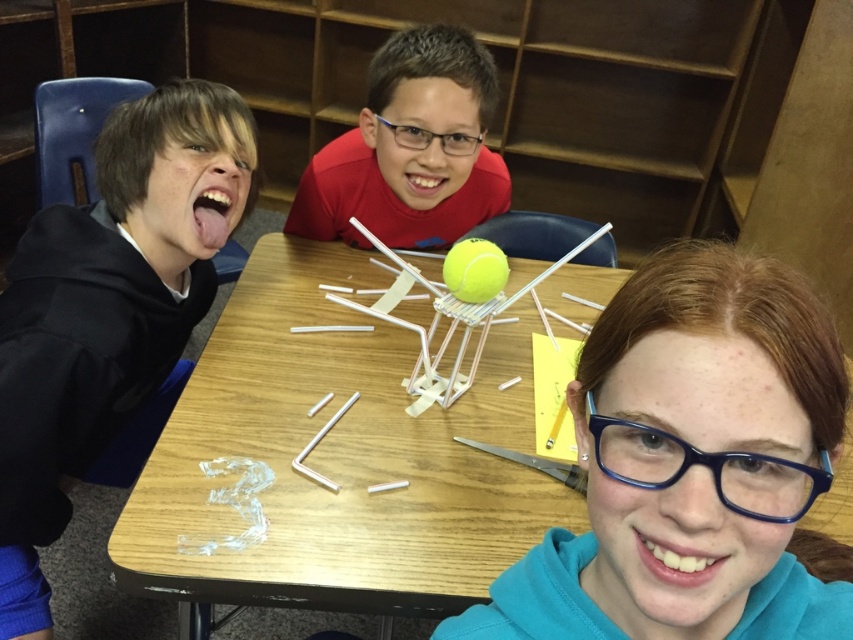
Question: Estimate the real-world distances between objects in this image. Which object is closer to the black hoodie at left?

Choices:
 (A) matte red shirt at center
 (B) wooden table at center
 (C) blue plastic hair at center

Answer: (B)

Question: Is wooden table at center further to the viewer compared to blue plastic hair at center?

Choices:
 (A) yes
 (B) no

Answer: (A)

Question: Which point is farther to the camera?

Choices:
 (A) blue plastic hair at center
 (B) matte red shirt at center
 (C) black hoodie at left
 (D) wooden table at center

Answer: (B)

Question: Can you confirm if black hoodie at left is positioned below matte red shirt at center?

Choices:
 (A) no
 (B) yes

Answer: (B)

Question: Among these points, which one is farthest from the camera?

Choices:
 (A) (247, 444)
 (B) (396, 198)
 (C) (49, 230)
 (D) (612, 570)

Answer: (B)

Question: Can you confirm if black hoodie at left is positioned above matte red shirt at center?

Choices:
 (A) yes
 (B) no

Answer: (B)